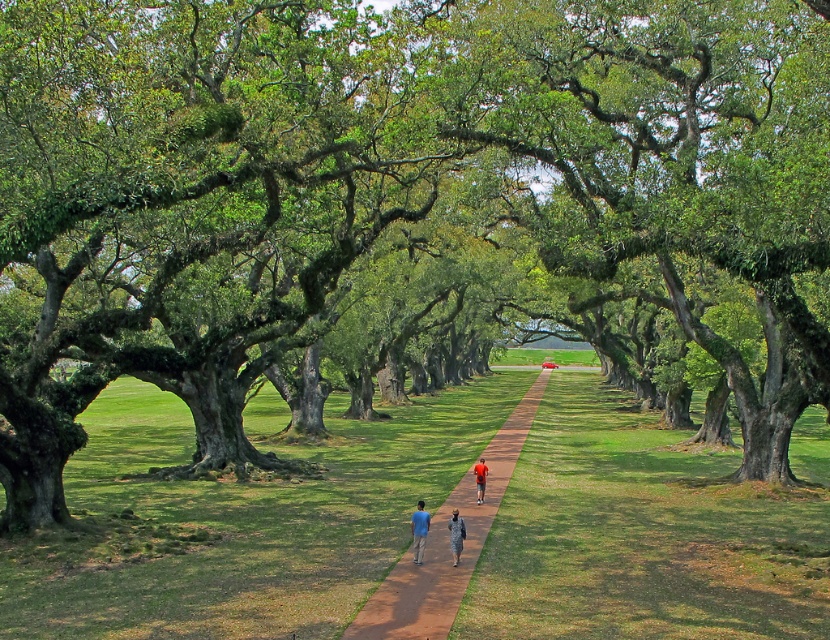
You are standing on the tree lined pathway and see two people made of fabric. One is camouflage fabric person at center and the other is orange fabric person at center. Which one is higher up?

The camouflage fabric person at center is above the orange fabric person at center, so the camouflage fabric person at center is higher up.

You are a photographer standing at the start of the tree lined pathway. You want to take a picture of the blue cotton shirt at center and camouflage fabric person at center. How far apart are the two subjects in the scene?

The blue cotton shirt at center is 28.49 inches from camouflage fabric person at center.

You are standing at the point marked as point (x=418, y=531) in the image. What object is located exactly at this point?

The blue cotton shirt at center is located exactly at point (x=418, y=531).